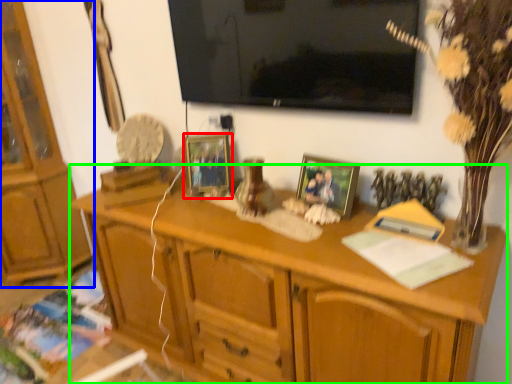
Question: Which object is positioned farthest from picture frame (highlighted by a red box)? Select from cabinetry (highlighted by a blue box) and desk (highlighted by a green box).

Choices:
 (A) cabinetry
 (B) desk

Answer: (A)